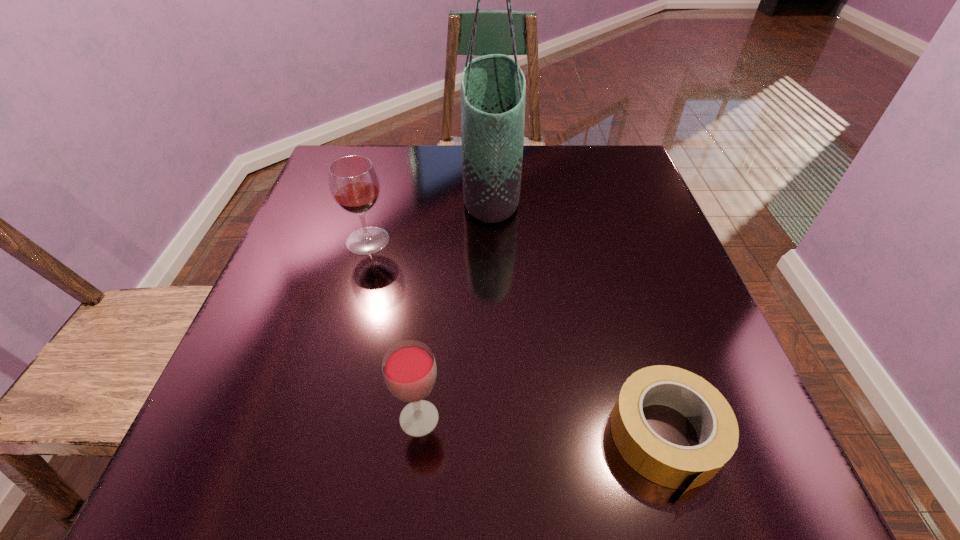
I want to click on free space located 0.260m on the left of the second shortest object, so click(224, 418).

You are a GUI agent. You are given a task and a screenshot of the screen. Output one action in this format:
    pyautogui.click(x=<x>, y=<y>)
    Task: Click on the object present at the far edge
    The width and height of the screenshot is (960, 540).
    Given the screenshot: What is the action you would take?
    pyautogui.click(x=493, y=88)

In order to click on object that is at the near edge in this screenshot , I will do `click(677, 467)`.

What are the coordinates of `object present at the left edge` in the screenshot? It's located at (353, 181).

Locate an element on the screen. object that is at the right edge is located at coordinates (677, 467).

Image resolution: width=960 pixels, height=540 pixels. Identify the location of object present at the near right corner. (677, 467).

The width and height of the screenshot is (960, 540). Identify the location of vacant space at the far edge. (386, 168).

Locate an element on the screen. The image size is (960, 540). free space at the near edge is located at coordinates (422, 452).

Image resolution: width=960 pixels, height=540 pixels. Find the location of `vacant space at the left edge`. vacant space at the left edge is located at coordinates (204, 433).

In the image, there is a desktop. Find the location of `vacant space at the right edge`. vacant space at the right edge is located at coordinates (609, 281).